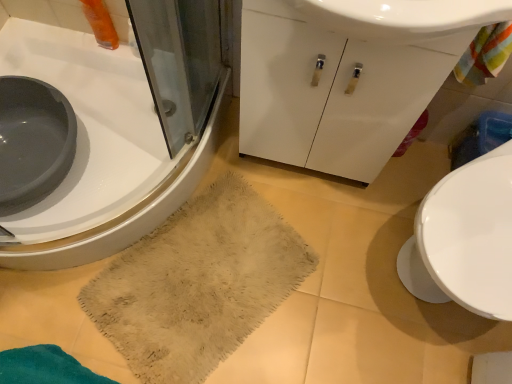
Identify the location of vacant region to the right of beige fuzzy rug at lower center. [x=348, y=294].